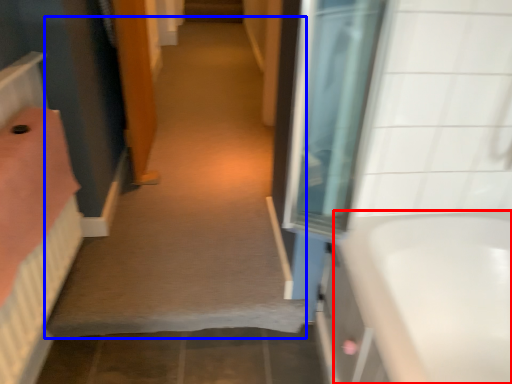
Question: Which point is closer to the camera, bathtub (highlighted by a red box) or plain (highlighted by a blue box)?

Choices:
 (A) bathtub
 (B) plain

Answer: (A)